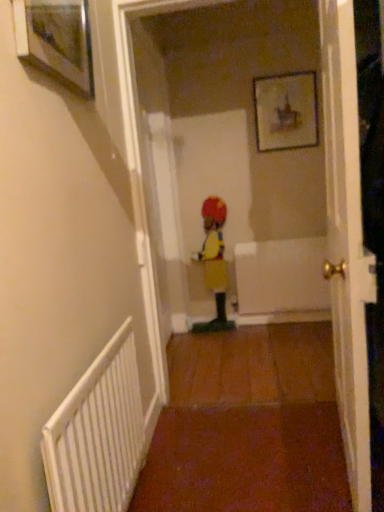
Question: Is white glossy door at center facing away from yellow fabric clown at center?

Choices:
 (A) no
 (B) yes

Answer: (A)

Question: From a real-world perspective, is white glossy door at center below yellow fabric clown at center?

Choices:
 (A) no
 (B) yes

Answer: (A)

Question: Would you consider white glossy door at center to be distant from yellow fabric clown at center?

Choices:
 (A) yes
 (B) no

Answer: (A)

Question: Does white glossy door at center have a larger size compared to yellow fabric clown at center?

Choices:
 (A) yes
 (B) no

Answer: (A)

Question: Is white glossy door at center at the right side of yellow fabric clown at center?

Choices:
 (A) no
 (B) yes

Answer: (B)

Question: In terms of size, does white textured radiator at lower left appear bigger or smaller than wooden framed picture at upper left, which ranks as the 2th picture frame in right-to-left order?

Choices:
 (A) small
 (B) big

Answer: (B)

Question: Relative to wooden framed picture at upper left, which ranks as the 2th picture frame in right-to-left order, is white textured radiator at lower left in front or behind?

Choices:
 (A) behind
 (B) front

Answer: (B)

Question: Looking at their shapes, would you say white textured radiator at lower left is wider or thinner than wooden framed picture at upper left, the 2th picture frame from the back?

Choices:
 (A) wide
 (B) thin

Answer: (A)

Question: Is point (105, 385) closer or farther from the camera than point (26, 22)?

Choices:
 (A) farther
 (B) closer

Answer: (A)

Question: Is white glossy door at center spatially inside wooden picture frame at upper center, the 2th picture frame when ordered from front to back, or outside of it?

Choices:
 (A) inside
 (B) outside

Answer: (B)

Question: Is white glossy door at center bigger or smaller than wooden picture frame at upper center, which is the 2th picture frame from left to right?

Choices:
 (A) big
 (B) small

Answer: (A)

Question: Is white glossy door at center taller or shorter than wooden picture frame at upper center, which is the 2th picture frame from left to right?

Choices:
 (A) short
 (B) tall

Answer: (B)

Question: Visually, is white glossy door at center positioned to the left or to the right of wooden picture frame at upper center, the first picture frame when ordered from back to front?

Choices:
 (A) right
 (B) left

Answer: (B)

Question: Is yellow fabric clown at center to the left or to the right of white textured radiator at lower left in the image?

Choices:
 (A) right
 (B) left

Answer: (A)

Question: Is yellow fabric clown at center inside the boundaries of white textured radiator at lower left, or outside?

Choices:
 (A) outside
 (B) inside

Answer: (A)